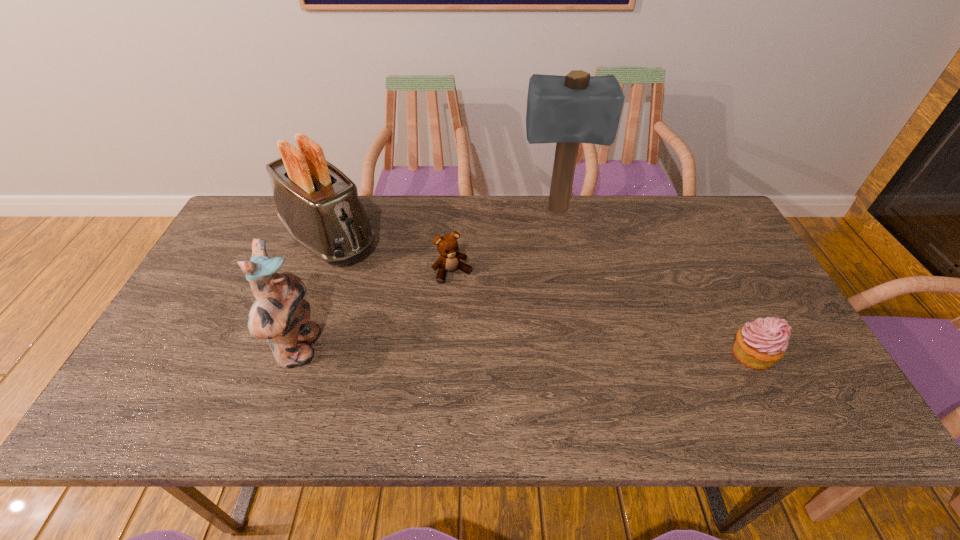
Point out which object is positioned as the third nearest to the third object from right to left. Please provide its 2D coordinates. Your answer should be formatted as a tuple, i.e. [(x, y)], where the tuple contains the x and y coordinates of a point satisfying the conditions above.

[(279, 313)]

Identify which object is the third closest to the toaster. Please provide its 2D coordinates. Your answer should be formatted as a tuple, i.e. [(x, y)], where the tuple contains the x and y coordinates of a point satisfying the conditions above.

[(577, 108)]

Where is `vacant region that satisfies the following two spatial constraints: 1. on the front side of the figurine; 2. on the front-facing side of the toaster`? This screenshot has height=540, width=960. vacant region that satisfies the following two spatial constraints: 1. on the front side of the figurine; 2. on the front-facing side of the toaster is located at coordinates click(x=290, y=349).

At what (x,y) coordinates should I click in order to perform the action: click on vacant point that satisfies the following two spatial constraints: 1. on the front side of the toaster; 2. on the right side of the third object from right to left. Please return your answer as a coordinate pair (x, y). The height and width of the screenshot is (540, 960). Looking at the image, I should click on (317, 273).